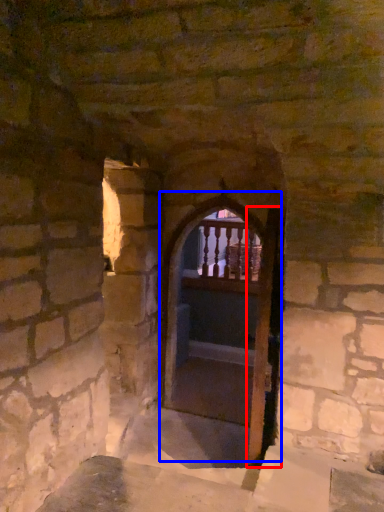
Question: Which of the following is the farthest to the observer, screen door (highlighted by a red box) or door (highlighted by a blue box)?

Choices:
 (A) screen door
 (B) door

Answer: (B)